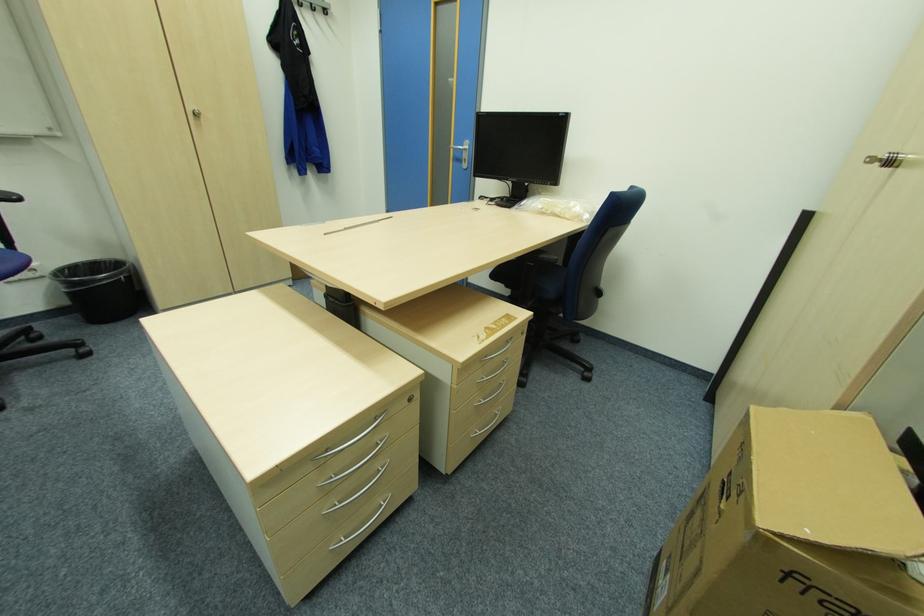
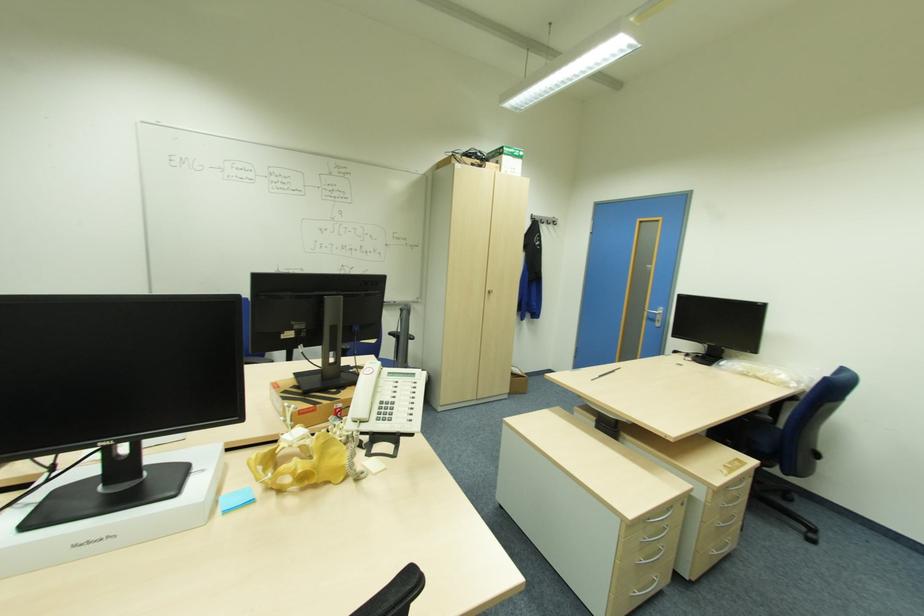
Where in the second image is the point corresponding to the point at 468,159 from the first image?

(661, 321)